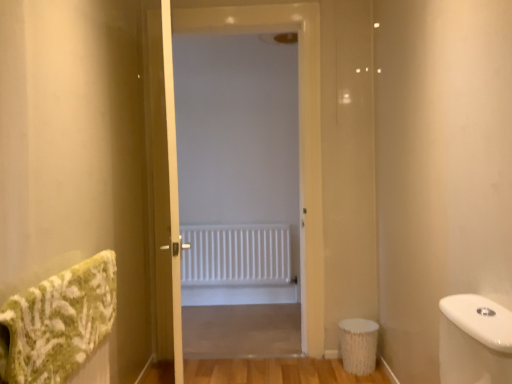
Question: Is white matte radiator at center to the left of wooden screen door at center from the viewer's perspective?

Choices:
 (A) yes
 (B) no

Answer: (B)

Question: Is the position of white matte radiator at center more distant than that of wooden screen door at center?

Choices:
 (A) no
 (B) yes

Answer: (B)

Question: From a real-world perspective, does white matte radiator at center sit lower than wooden screen door at center?

Choices:
 (A) yes
 (B) no

Answer: (B)

Question: From a real-world perspective, is white matte radiator at center over wooden screen door at center?

Choices:
 (A) yes
 (B) no

Answer: (A)

Question: From the image's perspective, does white matte radiator at center appear lower than wooden screen door at center?

Choices:
 (A) yes
 (B) no

Answer: (B)

Question: From their relative heights in the image, would you say white matte radiator at center is taller or shorter than green textured bath towel at left?

Choices:
 (A) tall
 (B) short

Answer: (A)

Question: Would you say white matte radiator at center is inside or outside green textured bath towel at left?

Choices:
 (A) outside
 (B) inside

Answer: (A)

Question: Looking at their shapes, would you say white matte radiator at center is wider or thinner than green textured bath towel at left?

Choices:
 (A) wide
 (B) thin

Answer: (B)

Question: Is white matte radiator at center bigger or smaller than green textured bath towel at left?

Choices:
 (A) big
 (B) small

Answer: (B)

Question: Is white matte radiator at center wider or thinner than white textured toilet bowl at lower right?

Choices:
 (A) thin
 (B) wide

Answer: (A)

Question: From a real-world perspective, is white matte radiator at center positioned above or below white textured toilet bowl at lower right?

Choices:
 (A) below
 (B) above

Answer: (B)

Question: Considering the relative positions of white matte radiator at center and white textured toilet bowl at lower right in the image provided, is white matte radiator at center to the left or to the right of white textured toilet bowl at lower right?

Choices:
 (A) right
 (B) left

Answer: (B)

Question: Relative to white textured toilet bowl at lower right, is white matte radiator at center in front or behind?

Choices:
 (A) front
 (B) behind

Answer: (B)

Question: Considering the relative positions of white textured toilet bowl at lower right and white matte radiator at center in the image provided, is white textured toilet bowl at lower right to the left or to the right of white matte radiator at center?

Choices:
 (A) right
 (B) left

Answer: (A)

Question: Would you say white textured toilet bowl at lower right is inside or outside white matte radiator at center?

Choices:
 (A) outside
 (B) inside

Answer: (A)